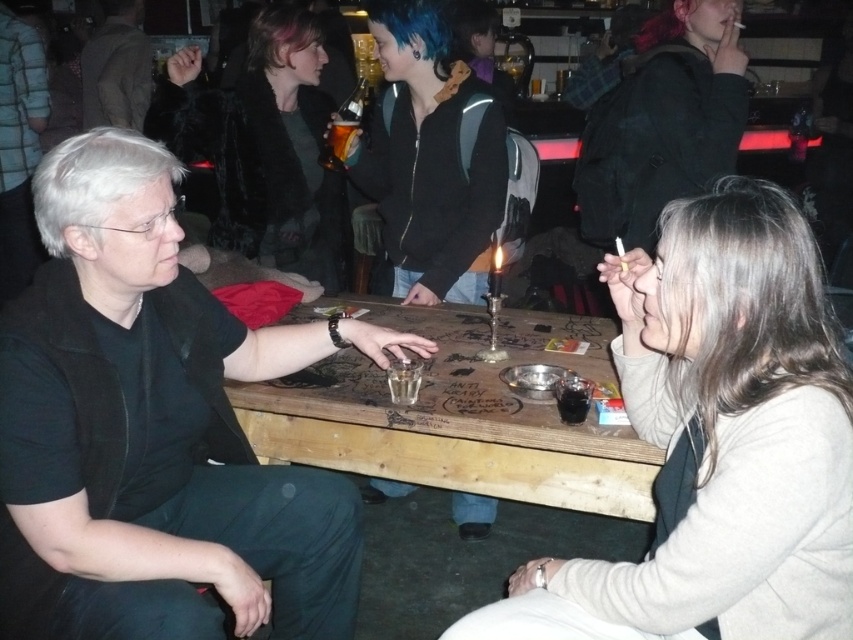
Question: Which point appears closest to the camera in this image?

Choices:
 (A) (297, 38)
 (B) (108, 49)

Answer: (A)

Question: Among these objects, which one is nearest to the camera?

Choices:
 (A) dark brown leather jacket at upper left
 (B) white matte hair at left
 (C) shiny black jacket at center
 (D) translucent amber liquid at center

Answer: (B)

Question: Does white matte hair at left appear on the left side of pink dyed hair at upper center?

Choices:
 (A) no
 (B) yes

Answer: (A)

Question: Among these points, which one is nearest to the camera?

Choices:
 (A) (459, 227)
 (B) (67, 433)
 (C) (115, 116)

Answer: (B)

Question: Is smooth beige sweater at lower right bigger than shiny black jacket at center?

Choices:
 (A) yes
 (B) no

Answer: (B)

Question: Does shiny black jacket at center have a lesser width compared to pink dyed hair at upper center?

Choices:
 (A) yes
 (B) no

Answer: (B)